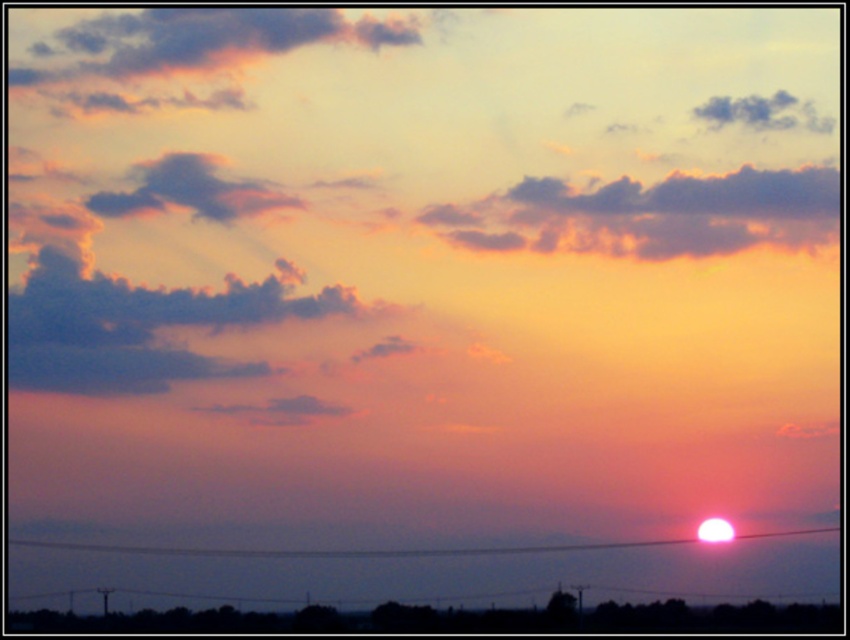
Question: Which object is the closest to the dark gray cloud at upper right?

Choices:
 (A) cloudy textured cloud at upper left
 (B) cloudy textured clouds at upper center

Answer: (B)

Question: Does cloudy textured clouds at upper center appear on the right side of cloudy textured cloud at upper left?

Choices:
 (A) yes
 (B) no

Answer: (A)

Question: Which point is farther to the camera?

Choices:
 (A) bright red wire at lower center
 (B) cloudy textured cloud at upper left
 (C) dark gray cloud at upper right
 (D) cloudy textured clouds at upper center

Answer: (C)

Question: Which of the following is the farthest from the observer?

Choices:
 (A) (715, 104)
 (B) (735, 538)
 (C) (621, 188)
 (D) (188, 161)

Answer: (D)

Question: Is cloudy textured cloud at upper left smaller than bright red wire at lower center?

Choices:
 (A) no
 (B) yes

Answer: (B)

Question: Is cloudy textured cloud at upper left to the right of bright red wire at lower center from the viewer's perspective?

Choices:
 (A) yes
 (B) no

Answer: (B)